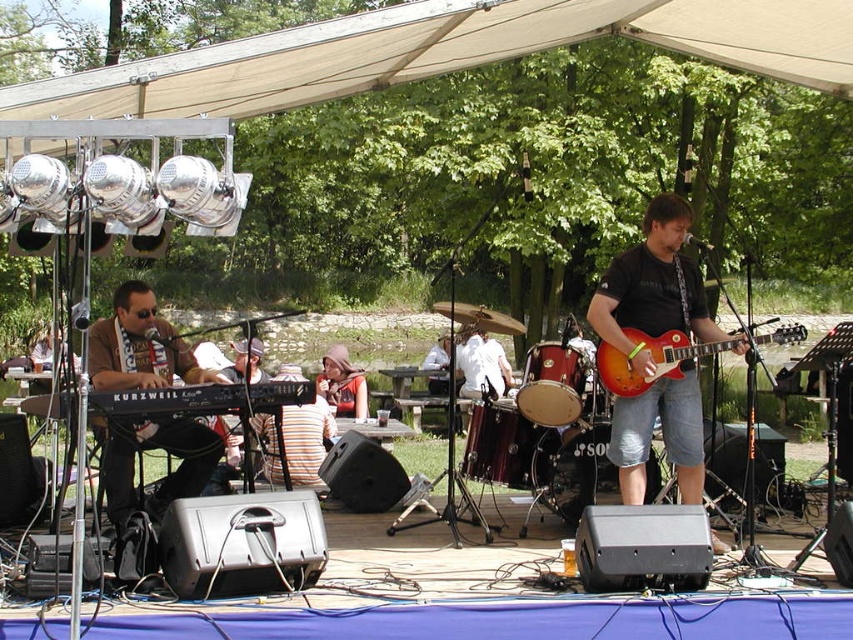
You are an audience member sitting at the picnic tables. You want to see both the black plastic keyboard at left and the striped fabric shirt at center clearly. Which one will you need to look up to see?

You will need to look up to see the black plastic keyboard at left because it is located above the striped fabric shirt at center.

You are a photographer at the live music performance. You want to take a photo of both the satin red guitar at center and the glossy wood guitar at center right. However, you can only position yourself in a spot where you can see one of them clearly without obstruction. Which guitar should you focus on to ensure it is fully visible in your photo?

The satin red guitar at center is fully visible because the glossy wood guitar at center right is behind it, so focusing on the satin red guitar at center will ensure it is not obstructed.

You are standing in the audience area and want to walk towards both the point at coordinates point (616, 285) and the point at coordinates point (675, 339). Which point will you reach first?

You will reach point (616, 285) first because it is closer to you than point (675, 339), which is further away.